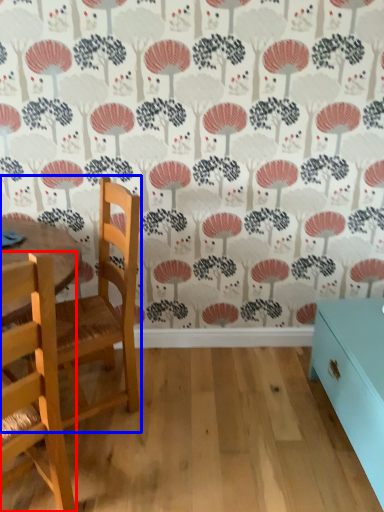
Question: Which of the following is the closest to the observer, chair (highlighted by a red box) or chair (highlighted by a blue box)?

Choices:
 (A) chair
 (B) chair

Answer: (A)